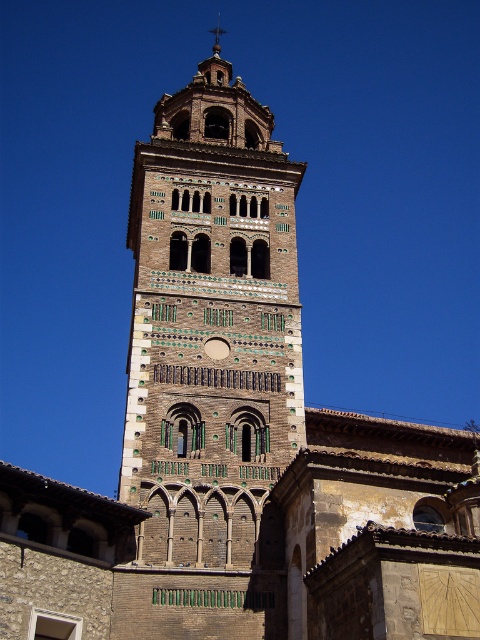
Question: Among these objects, which one is farthest from the camera?

Choices:
 (A) polished copper spire at upper center
 (B) brown brick tower at center

Answer: (A)

Question: Observing the image, what is the correct spatial positioning of brown brick tower at center in reference to polished copper spire at upper center?

Choices:
 (A) below
 (B) above

Answer: (A)

Question: Does brown brick tower at center have a larger size compared to polished copper spire at upper center?

Choices:
 (A) no
 (B) yes

Answer: (B)

Question: Among these points, which one is nearest to the camera?

Choices:
 (A) (210, 29)
 (B) (298, 388)

Answer: (B)

Question: Is brown brick tower at center positioned in front of polished copper spire at upper center?

Choices:
 (A) yes
 (B) no

Answer: (A)

Question: Which point is closer to the camera?

Choices:
 (A) (207, 492)
 (B) (222, 28)

Answer: (A)